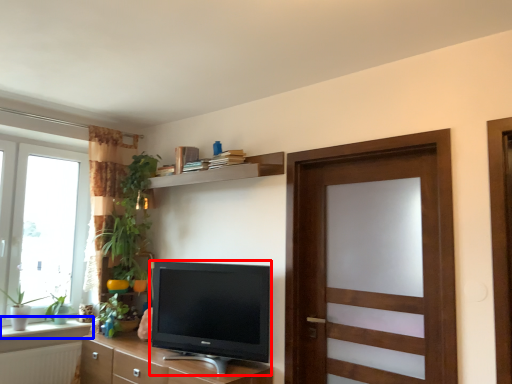
Question: Which object appears closest to the camera in this image, television (highlighted by a red box) or window sill (highlighted by a blue box)?

Choices:
 (A) television
 (B) window sill

Answer: (A)